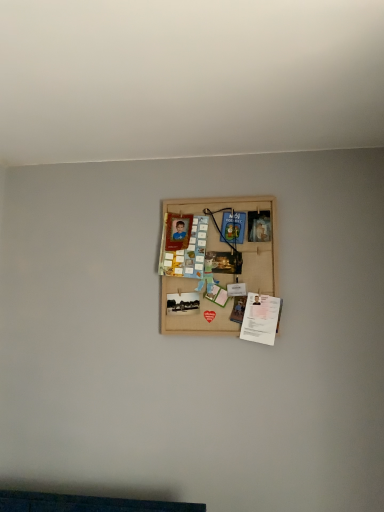
What are the coordinates of `bamboo mat board at center` in the screenshot? It's located at (217, 264).

Image resolution: width=384 pixels, height=512 pixels. Describe the element at coordinates (217, 264) in the screenshot. I see `bamboo mat board at center` at that location.

The image size is (384, 512). Find the location of `white paper at lower right`. white paper at lower right is located at coordinates (260, 318).

What do you see at coordinates (260, 318) in the screenshot? Image resolution: width=384 pixels, height=512 pixels. I see `white paper at lower right` at bounding box center [260, 318].

Identify the location of bamboo mat board at center. (217, 264).

Consider the image. Is white paper at lower right to the right of bamboo mat board at center from the viewer's perspective?

Indeed, white paper at lower right is positioned on the right side of bamboo mat board at center.

Is the depth of white paper at lower right less than that of bamboo mat board at center?

Yes, it is.

Considering the positions of points (270, 327) and (227, 324), is point (270, 327) farther from camera compared to point (227, 324)?

No, (270, 327) is in front of (227, 324).

From the image's perspective, which is below, white paper at lower right or bamboo mat board at center?

From the image's view, white paper at lower right is below.

From a real-world perspective, which object stands above the other?

In real-world perspective, bamboo mat board at center is above.

Which object is wider, white paper at lower right or bamboo mat board at center?

Wider between the two is white paper at lower right.

In terms of height, does white paper at lower right look taller or shorter compared to bamboo mat board at center?

white paper at lower right is shorter than bamboo mat board at center.

Between white paper at lower right and bamboo mat board at center, which one has larger size?

bamboo mat board at center is bigger.

Is white paper at lower right outside of bamboo mat board at center?

Actually, white paper at lower right is at least partially inside bamboo mat board at center.

Is white paper at lower right next to bamboo mat board at center and touching it?

white paper at lower right is not next to bamboo mat board at center, and they're not touching.

Is bamboo mat board at center at the back of white paper at lower right?

Yes, white paper at lower right's orientation is away from bamboo mat board at center.

Can you tell me how much white paper at lower right and bamboo mat board at center differ in facing direction?

There is a 5.75-degree angle between the facing directions of white paper at lower right and bamboo mat board at center.

The image size is (384, 512). Identify the location of writing below the bamboo mat board at center (from the image's perspective). (260, 318).

In the scene shown: Between bamboo mat board at center and white paper at lower right, which one appears on the right side from the viewer's perspective?

white paper at lower right.

Is bamboo mat board at center in front of or behind white paper at lower right in the image?

In the image, bamboo mat board at center appears behind white paper at lower right.

Between point (221, 246) and point (261, 329), which one is positioned behind?

The point (221, 246) is farther.

Looking at this image, from the image's perspective, is bamboo mat board at center over white paper at lower right?

Yes, from the image's perspective, bamboo mat board at center is on top of white paper at lower right.

From a real-world perspective, is bamboo mat board at center below white paper at lower right?

Incorrect, from a real-world perspective, bamboo mat board at center is higher than white paper at lower right.

Does bamboo mat board at center have a lesser width compared to white paper at lower right?

Indeed, bamboo mat board at center has a lesser width compared to white paper at lower right.

Can you confirm if bamboo mat board at center is taller than white paper at lower right?

Yes, bamboo mat board at center is taller than white paper at lower right.

Can you confirm if bamboo mat board at center is bigger than white paper at lower right?

Indeed, bamboo mat board at center has a larger size compared to white paper at lower right.

Is white paper at lower right inside bamboo mat board at center?

Yes, white paper at lower right is inside bamboo mat board at center.

Looking at this image, is bamboo mat board at center next to white paper at lower right and touching it?

No, bamboo mat board at center is not making contact with white paper at lower right.

Is bamboo mat board at center looking in the opposite direction of white paper at lower right?

Yes, bamboo mat board at center is facing away from white paper at lower right.

Find the location of a particular element. picture frame positioned vertically above the white paper at lower right (from a real-world perspective) is located at coordinates (217, 264).

This screenshot has height=512, width=384. In order to click on writing located underneath the bamboo mat board at center (from a real-world perspective) in this screenshot , I will do `click(260, 318)`.

You are a GUI agent. You are given a task and a screenshot of the screen. Output one action in this format:
    pyautogui.click(x=<x>, y=<y>)
    Task: Click on the picture frame behind the white paper at lower right
    This screenshot has height=512, width=384.
    Given the screenshot: What is the action you would take?
    pyautogui.click(x=217, y=264)